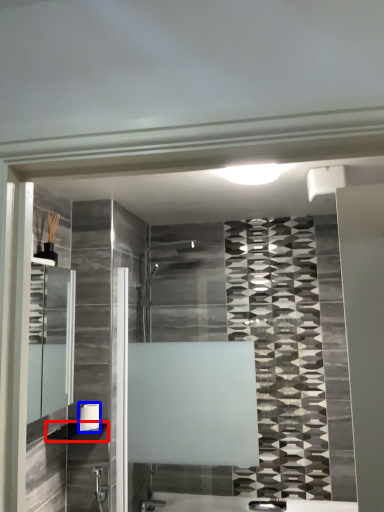
Question: Which of the following is the farthest to the observer, shelf (highlighted by a red box) or towel bar (highlighted by a blue box)?

Choices:
 (A) shelf
 (B) towel bar

Answer: (B)